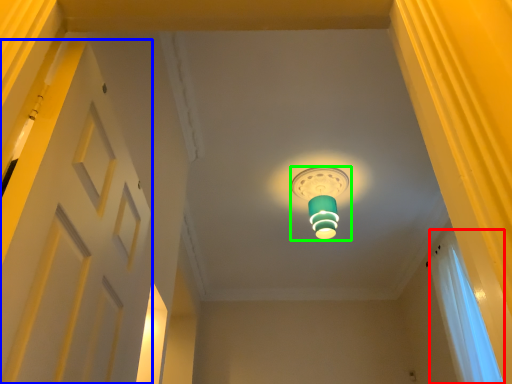
Question: Estimate the real-world distances between objects in this image. Which object is farther from curtain (highlighted by a red box), door (highlighted by a blue box) or lamp (highlighted by a green box)?

Choices:
 (A) door
 (B) lamp

Answer: (A)